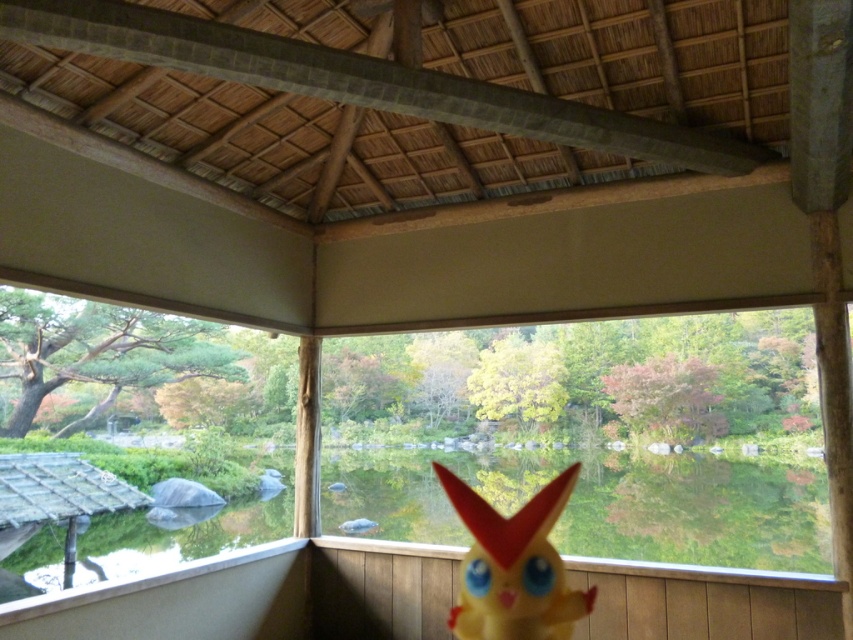
Measure the distance between transparent glass window at left and yellow rubber toy at center.

transparent glass window at left and yellow rubber toy at center are 49.81 feet apart from each other.

Between transparent glass window at left and yellow rubber toy at center, which one is positioned higher?

yellow rubber toy at center is higher up.

What do you see at coordinates (136, 445) in the screenshot? I see `transparent glass window at left` at bounding box center [136, 445].

Where is `transparent glass window at left`? The height and width of the screenshot is (640, 853). transparent glass window at left is located at coordinates [136, 445].

Locate an element on the screen. transparent glass window at center is located at coordinates (590, 435).

Between transparent glass window at center and yellow rubber toy at center, which one has less height?

yellow rubber toy at center

Is point (427, 355) behind point (450, 488)?

Yes, point (427, 355) is farther from viewer.

In order to click on transparent glass window at center in this screenshot , I will do `click(590, 435)`.

Based on the photo, between transparent glass window at center and transparent glass window at left, which one appears on the left side from the viewer's perspective?

transparent glass window at left

What do you see at coordinates (590, 435) in the screenshot? I see `transparent glass window at center` at bounding box center [590, 435].

At what (x,y) coordinates should I click in order to perform the action: click on transparent glass window at center. Please return your answer as a coordinate pair (x, y). This screenshot has height=640, width=853. Looking at the image, I should click on (590, 435).